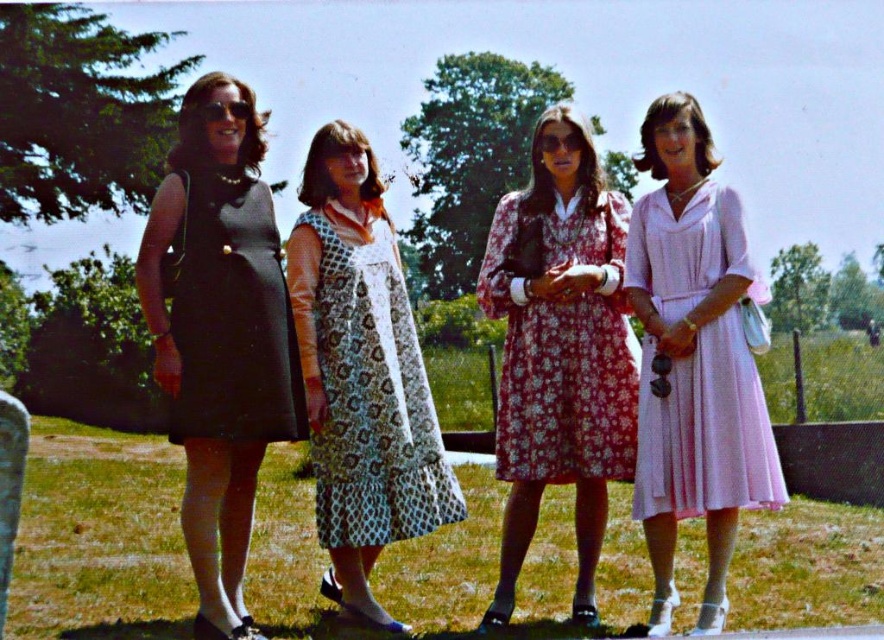
Does matte black dress at left appear on the left side of printed fabric dress at center?

Yes, matte black dress at left is to the left of printed fabric dress at center.

Who is more distant from viewer, (277, 436) or (386, 490)?

Positioned behind is point (386, 490).

Is point (187, 508) positioned behind point (402, 305)?

No, (187, 508) is closer to viewer.

Identify the location of matte black dress at left. The width and height of the screenshot is (884, 640). (221, 333).

Is matte black dress at left above black matte dress at left?

Incorrect, matte black dress at left is not positioned above black matte dress at left.

Who is taller, matte black dress at left or black matte dress at left?

Standing taller between the two is matte black dress at left.

Describe the element at coordinates (221, 333) in the screenshot. I see `matte black dress at left` at that location.

Find the location of a particular element. matte black dress at left is located at coordinates (221, 333).

Which is in front, point (447, 509) or point (776, 483)?

Positioned in front is point (776, 483).

This screenshot has height=640, width=884. I want to click on printed fabric dress at center, so click(370, 396).